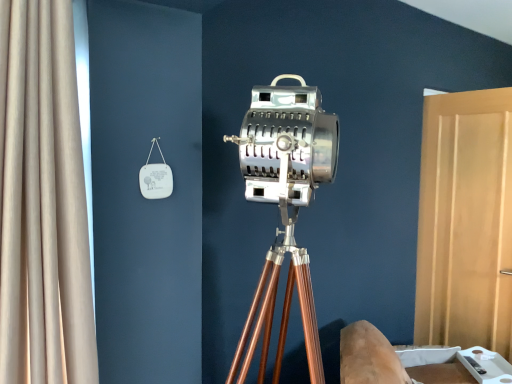
In order to face wooden door at right, should I rotate leftwards or rightwards?

A 26.383 degree turn to the right will do.

Describe the element at coordinates (465, 221) in the screenshot. I see `wooden door at right` at that location.

At what (x,y) coordinates should I click in order to perform the action: click on wooden door at right. Please return your answer as a coordinate pair (x, y). The width and height of the screenshot is (512, 384). Looking at the image, I should click on (465, 221).

Where is `wooden door at right`? This screenshot has height=384, width=512. wooden door at right is located at coordinates [x=465, y=221].